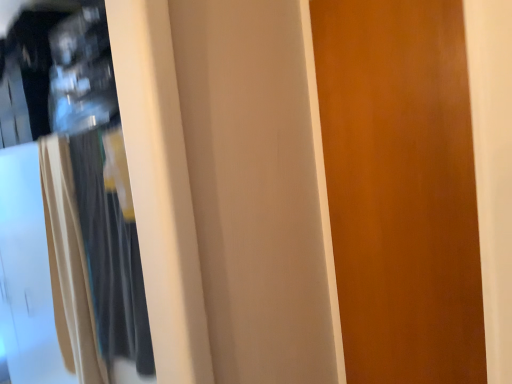
This screenshot has height=384, width=512. What do you see at coordinates (26, 273) in the screenshot?
I see `matte black screen door at left` at bounding box center [26, 273].

In order to click on matte black screen door at left in this screenshot , I will do `click(26, 273)`.

The image size is (512, 384). I want to click on matte black screen door at left, so click(26, 273).